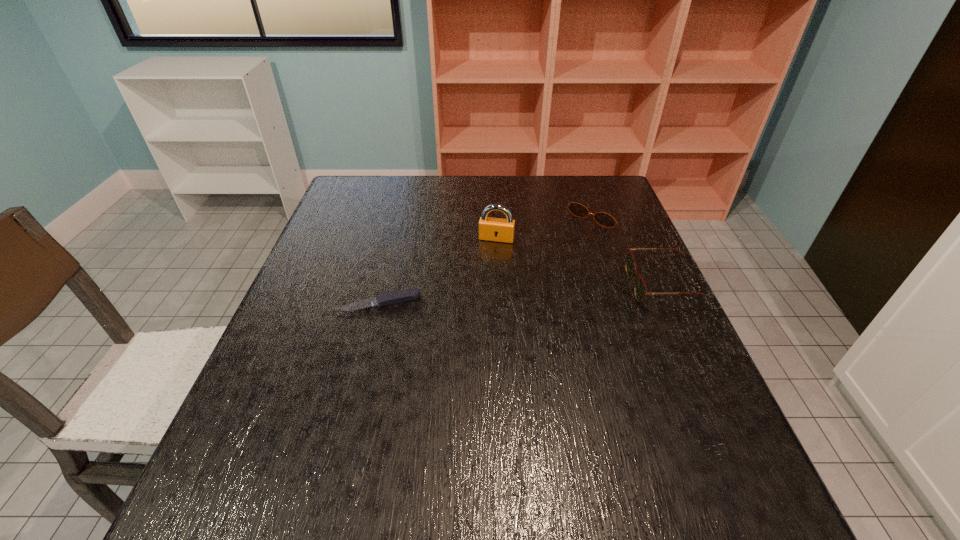
At what (x,y) coordinates should I click in order to perform the action: click on the leftmost object. Please return your answer as a coordinate pair (x, y). The height and width of the screenshot is (540, 960). Looking at the image, I should click on (395, 297).

The width and height of the screenshot is (960, 540). Identify the location of the shortest object. (395, 297).

You are a GUI agent. You are given a task and a screenshot of the screen. Output one action in this format:
    pyautogui.click(x=<x>, y=<y>)
    Task: Click on the third shortest object
    
    Given the screenshot: What is the action you would take?
    pyautogui.click(x=640, y=289)

You are a GUI agent. You are given a task and a screenshot of the screen. Output one action in this format:
    pyautogui.click(x=<x>, y=<y>)
    Task: Click on the third tallest object
    The image size is (960, 540).
    Given the screenshot: What is the action you would take?
    pos(577,209)

Identify the location of the farthest object. (577, 209).

I want to click on the third nearest object, so 490,229.

Identify the location of padlock. (x=490, y=229).

At what (x,y) coordinates should I click in order to perform the action: click on blank space located 0.050m on the back of the leftmost object. Please return your answer as a coordinate pair (x, y). This screenshot has width=960, height=540. Looking at the image, I should click on (385, 279).

Find the location of a particular element. This screenshot has width=960, height=540. vacant space situated 0.370m at the front view of the second tallest object is located at coordinates (483, 286).

Find the location of a particular element. This screenshot has width=960, height=540. free space located 0.070m at the front view of the second tallest object is located at coordinates (603, 286).